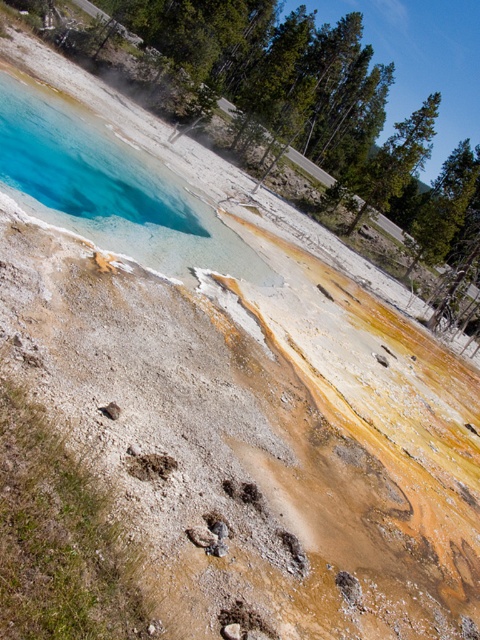
You are a park ranger checking the geothermal area. You see the blue translucent pool at upper left and the brown sandy footprint at lower center. Which object is higher in elevation?

The blue translucent pool at upper left is much taller than the brown sandy footprint at lower center, so the blue translucent pool at upper left is higher in elevation.

You are standing at the point marked as point (110, 189) in the geothermal area. What is the nearest object to you?

The blue translucent pool at upper left is located at point (110, 189), so you are standing right at the blue translucent pool at upper left.

You are a park ranger assessing the geothermal area. You need to determine if the blue translucent pool at upper left and the brown sandy footprint at lower center can both be safely marked for a guided tour path. Considering their sizes, which one might require a larger safety zone around it?

The blue translucent pool at upper left is larger in size than the brown sandy footprint at lower center, so it would require a larger safety zone around it.